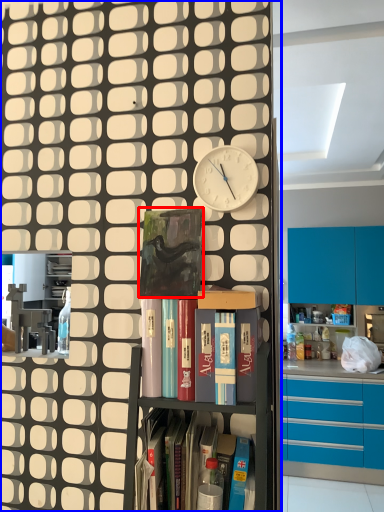
Question: Which object is further to the camera taking this photo, paperback book (highlighted by a red box) or cupboard (highlighted by a blue box)?

Choices:
 (A) paperback book
 (B) cupboard

Answer: (A)